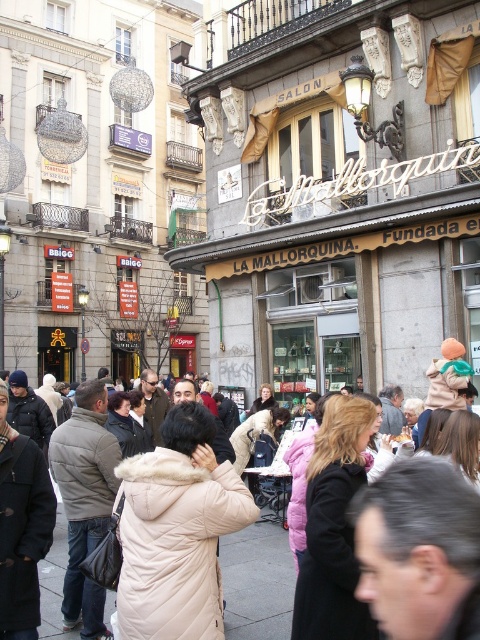
You are a window cleaner with a ladder that can reach up to 2 meters. You need to clean the matte yellow awning at center and the beige wool coat at center. Which object can you reach with your ladder?

The beige wool coat at center can be reached with the ladder since it is shorter than the matte yellow awning at center, and the ladder can only reach up to 2 meters.

You are a tailor who needs to determine which coat to recommend to a customer who prefers a more spacious fit. The customer is looking at the beige wool coat at center and the beige quilted coat at center. Based on their widths, which coat would you suggest?

The beige wool coat at center has a larger width than the beige quilted coat at center, so it would provide a more spacious fit and is the better recommendation.

Consider the image. You are a window cleaner standing on the ground in front of the matte yellow awning at center and the beige quilted coat at center. You need to clean the window above both objects. Which object will require you to climb higher to reach the window?

The matte yellow awning at center is much taller than the beige quilted coat at center, so you will need to climb higher to reach the window above the matte yellow awning at center.